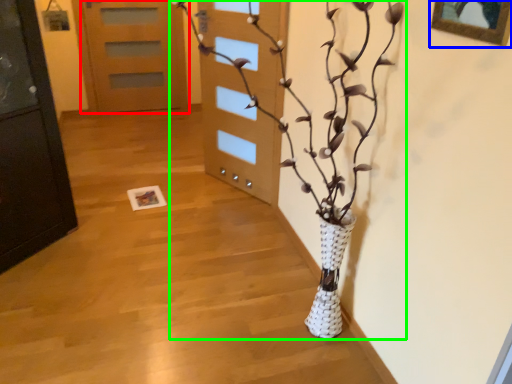
Question: Which is farther away from door (highlighted by a red box)? picture frame (highlighted by a blue box) or houseplant (highlighted by a green box)?

Choices:
 (A) picture frame
 (B) houseplant

Answer: (A)